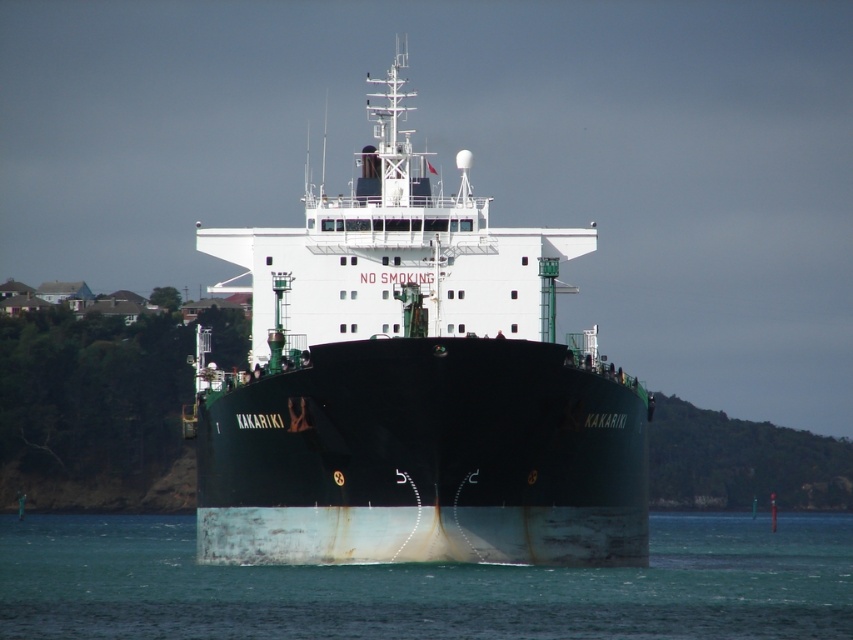
Is green matte ship at center to the right of smooth teal water at center from the viewer's perspective?

Incorrect, green matte ship at center is not on the right side of smooth teal water at center.

Is green matte ship at center thinner than smooth teal water at center?

Yes, green matte ship at center is thinner than smooth teal water at center.

Is point (563, 448) closer to camera compared to point (426, 621)?

No.

Identify the location of green matte ship at center. The width and height of the screenshot is (853, 640). (413, 387).